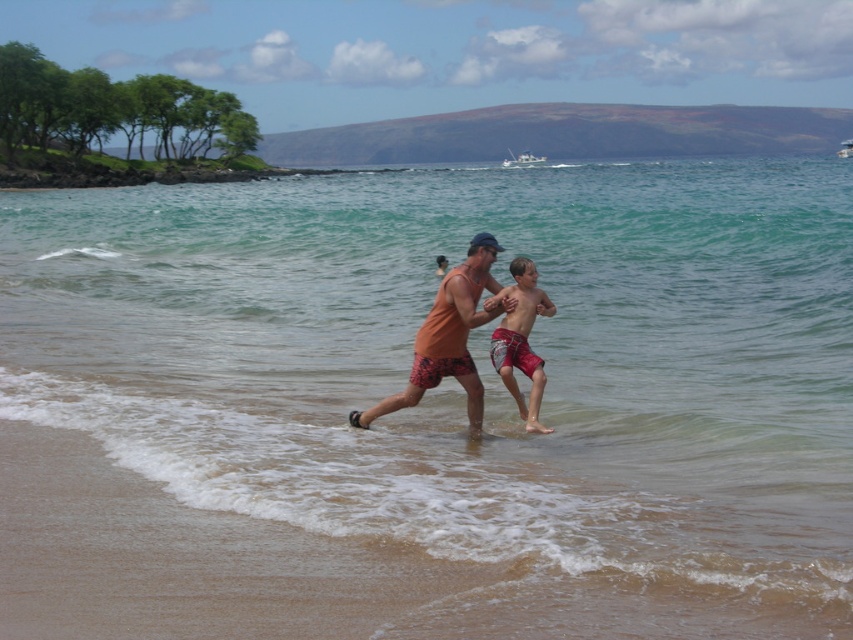
You are a photographer trying to capture a candid shot of the two people at the beach. You want to ensure both the orange cotton tank top at center and the red plaid shorts at center are clearly visible in the frame. Given that your camera has a minimum focus distance of 12 inches, will you be able to capture both items in focus without moving closer?

The orange cotton tank top at center and the red plaid shorts at center are 14.07 inches apart from each other. Since the distance between them exceeds the camera minimum focus distance of 12 inches, the camera should be able to keep both items in focus without moving closer.

You are a photographer trying to capture the orange cotton tank top at center in the beach scene. Based on its coordinates, where should you aim your camera to ensure it is centered in the frame?

The orange cotton tank top at center is located at coordinates point (448, 337), so you should aim your camera at that point to center it in the frame.

You are standing at the shoreline and see two points marked in the image. The first point is at coordinate point (483, 234) and the second is at point (529, 296). Which point is closer to you?

Point (483, 234) is in front of point (529, 296), so it is closer to you.